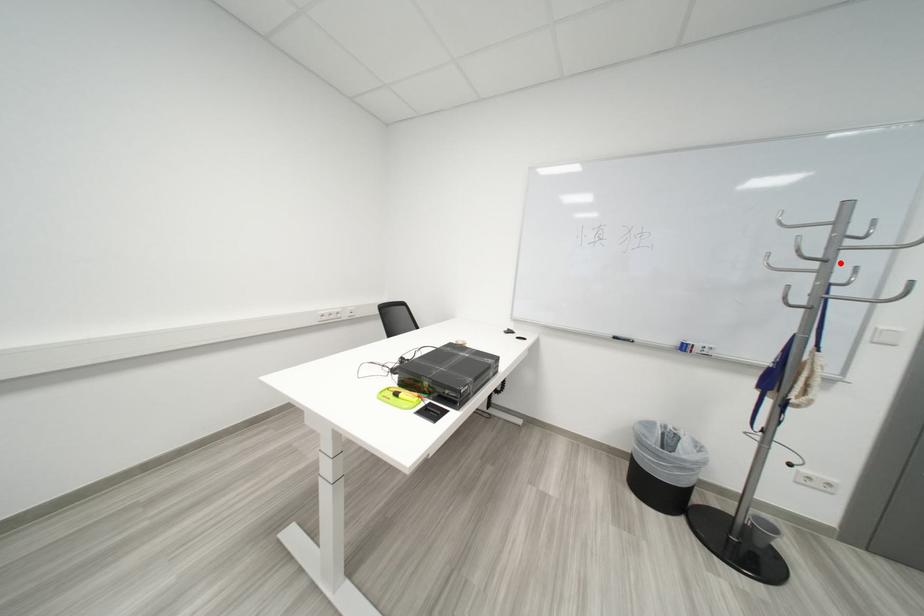
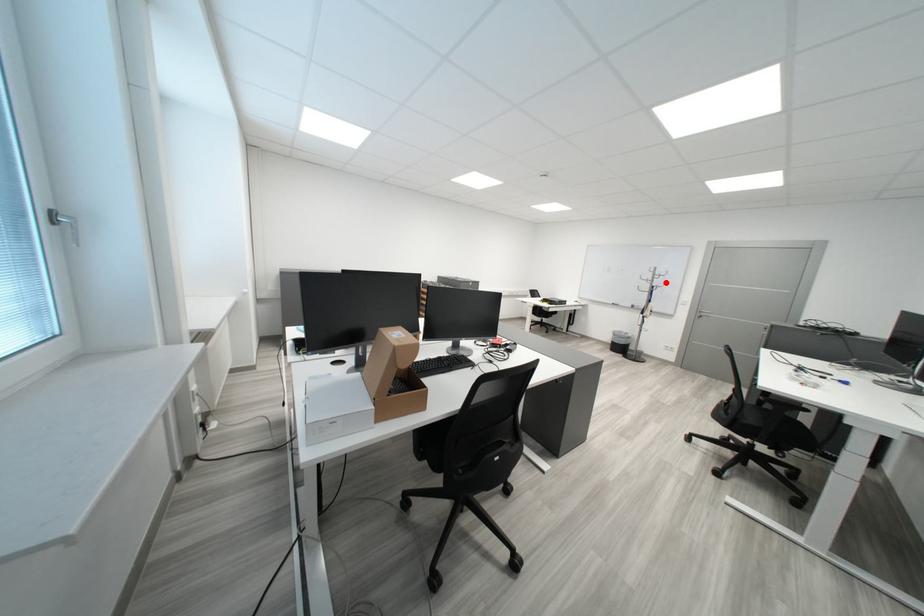
I am providing you with two images of the same scene from different viewpoints. A red point is marked on the first image and another point is marked on the second image. Does the point marked in image1 correspond to the same location as the one in image2?

Yes